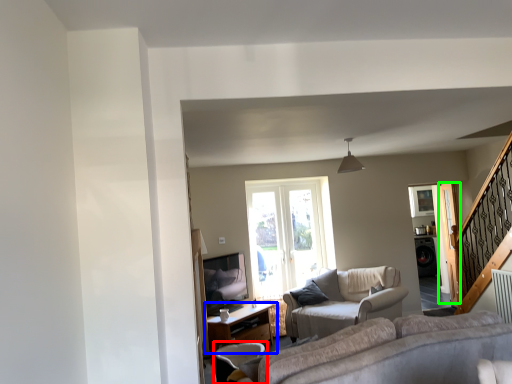
Question: Which is nearer to the chair (highlighted by a red box)? table (highlighted by a blue box) or screen door (highlighted by a green box).

Choices:
 (A) table
 (B) screen door

Answer: (A)